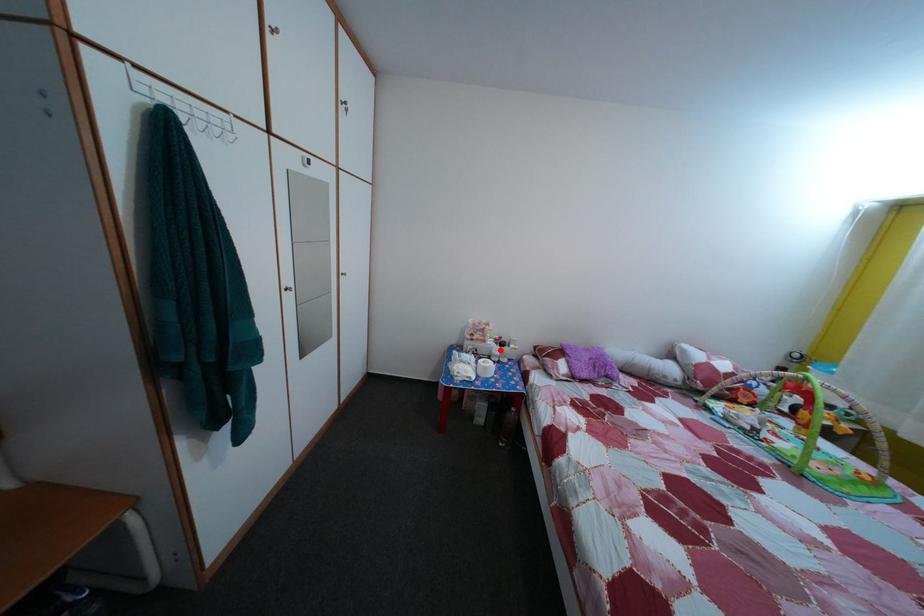
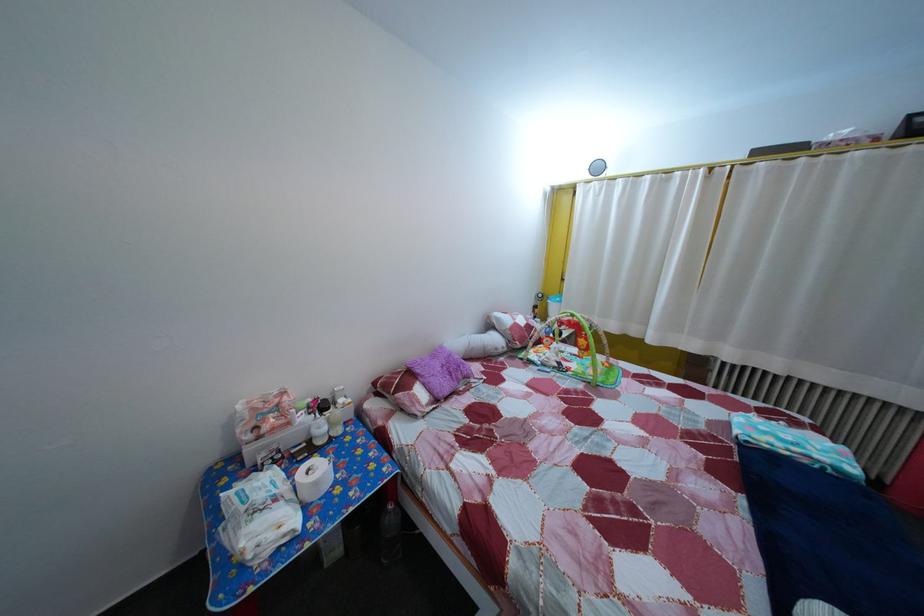
In the second image, find the point that corresponds to the highlighted location in the first image.

(311, 427)